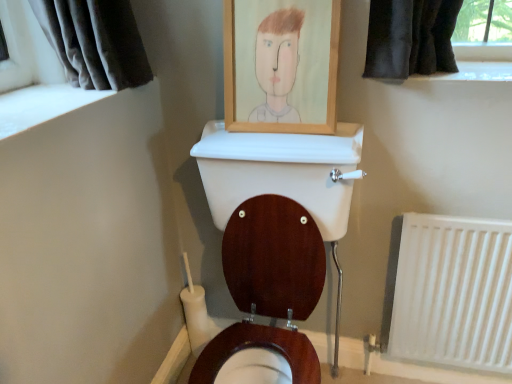
Question: Based on their positions, is white plastic radiator at lower right located to the left or right of wooden picture frame at upper center?

Choices:
 (A) right
 (B) left

Answer: (A)

Question: Is point (418, 226) closer or farther from the camera than point (318, 71)?

Choices:
 (A) closer
 (B) farther

Answer: (B)

Question: Based on their sizes in the image, would you say white plastic radiator at lower right is bigger or smaller than wooden picture frame at upper center?

Choices:
 (A) big
 (B) small

Answer: (A)

Question: Considering the positions of wooden picture frame at upper center and white plastic radiator at lower right in the image, is wooden picture frame at upper center taller or shorter than white plastic radiator at lower right?

Choices:
 (A) short
 (B) tall

Answer: (A)

Question: From the image's perspective, is wooden picture frame at upper center above or below white plastic radiator at lower right?

Choices:
 (A) above
 (B) below

Answer: (A)

Question: Considering the positions of wooden picture frame at upper center and white plastic radiator at lower right in the image, is wooden picture frame at upper center wider or thinner than white plastic radiator at lower right?

Choices:
 (A) thin
 (B) wide

Answer: (B)

Question: In terms of size, does wooden picture frame at upper center appear bigger or smaller than white plastic radiator at lower right?

Choices:
 (A) small
 (B) big

Answer: (A)